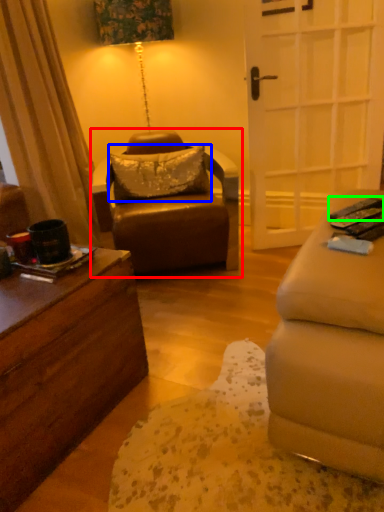
Question: Estimate the real-world distances between objects in this image. Which object is closer to chair (highlighted by a red box), pillow (highlighted by a blue box) or remote control (highlighted by a green box)?

Choices:
 (A) pillow
 (B) remote control

Answer: (A)